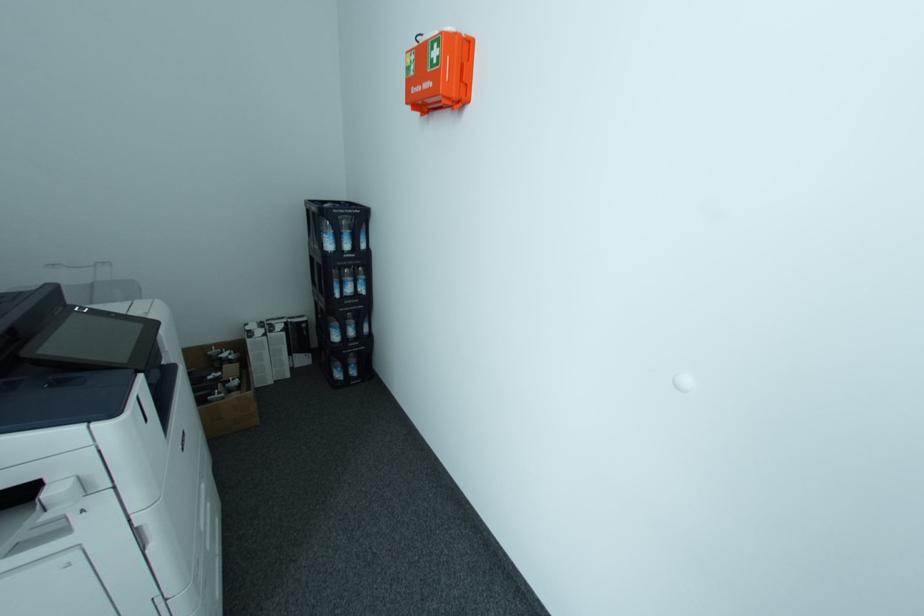
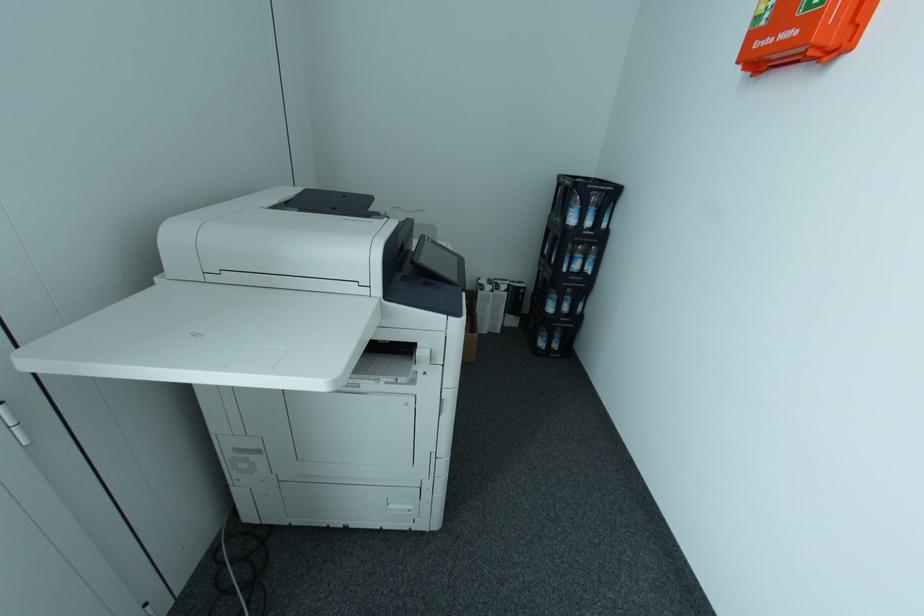
Question: The camera is either moving clockwise (left) or counter-clockwise (right) around the object. The first image is from the beginning of the video and the second image is from the end. Is the camera moving left or right when shooting the video?

Choices:
 (A) Left
 (B) Right

Answer: (B)